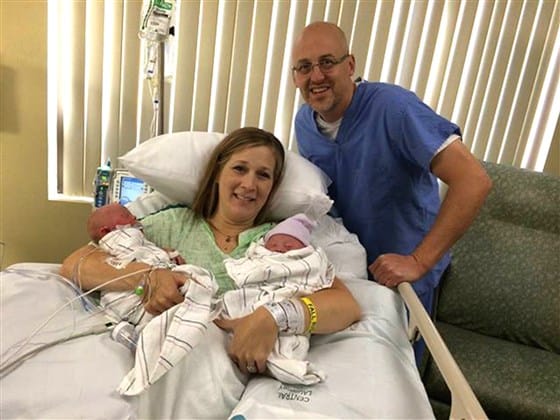
At what (x,y) coordinates should I click in order to perform the action: click on chair. Please return your answer as a coordinate pair (x, y). This screenshot has width=560, height=420. Looking at the image, I should click on (511, 282), (508, 379).